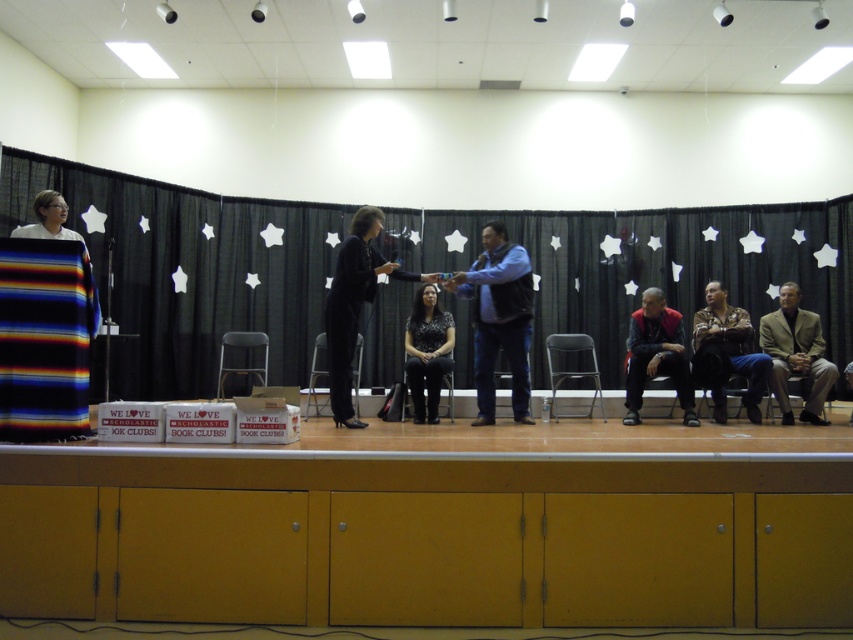
You are an event planner setting up a camera to capture the stage. The camera needs to focus on the black fabric curtain at upper center. According to the coordinates provided, where should you position the camera to ensure the curtain is centered in the frame?

The black fabric curtain at upper center is located at point (189, 269), so position the camera so that the center of the frame aligns with these coordinates to capture the curtain properly.

From the picture: You are an event planner setting up for a ceremony. You need to ensure that the black fabric curtain at upper center does not block the view of the dark gray sweater at center. Based on the scene description, will the curtain be shorter than the sweater?

The black fabric curtain at upper center is not as tall as the dark gray sweater at center, so yes, the curtain will be shorter than the sweater, ensuring it does not block the view.